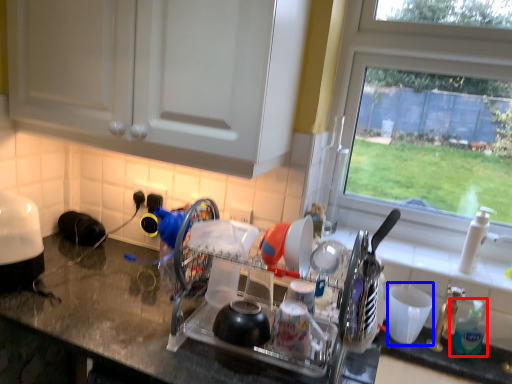
Question: Which point is closer to the camera, soap dispenser (highlighted by a red box) or tableware (highlighted by a blue box)?

Choices:
 (A) soap dispenser
 (B) tableware

Answer: (A)